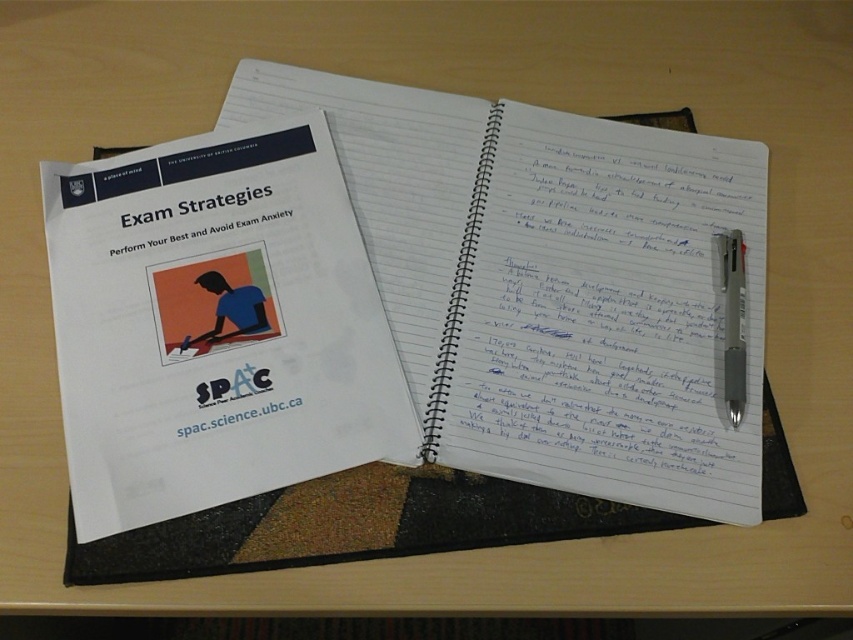
You are a student trying to locate a specific point on your desk. The point is marked as point (616, 376). Given that the desk is 1.2 meters wide, can you estimate whether this point is closer to the left or right edge of the desk?

The point (616, 376) is 57.02 centimeters away from the camera. Since the desk is 1.2 meters wide, the midpoint is at 60 centimeters. The point is slightly closer to the left edge of the desk as it is 2.98 centimeters away from the midpoint towards the left.

You are a student who needs to write a note. You see the white lined paper at center and the silver metallic pen at upper right. Where is the pen located relative to the paper?

The silver metallic pen at upper right is below the white lined paper at center because the white lined paper at center is above the silver metallic pen at upper right.